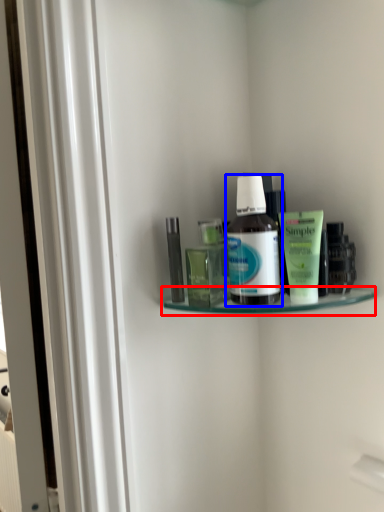
Question: Which of the following is the farthest to the observer, shelf (highlighted by a red box) or bottle (highlighted by a blue box)?

Choices:
 (A) shelf
 (B) bottle

Answer: (B)